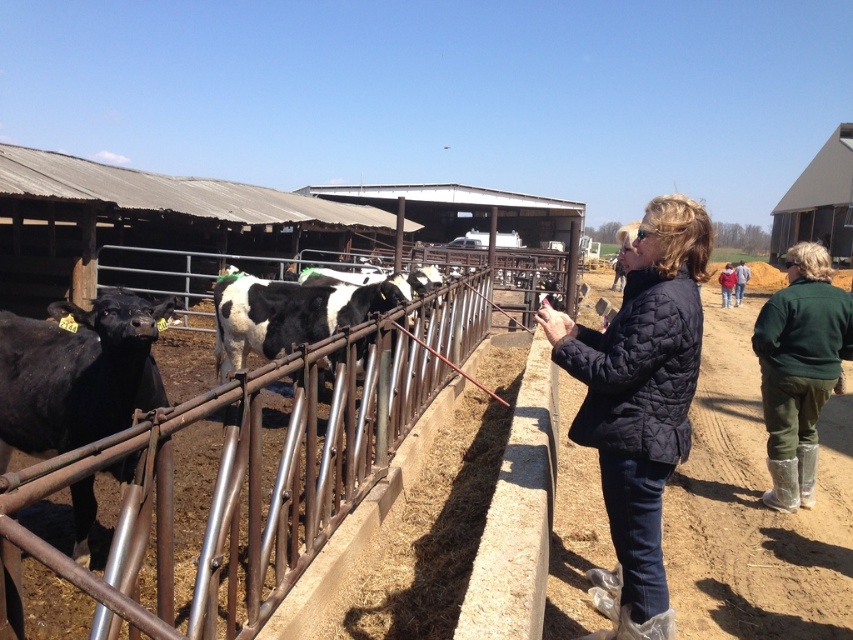
Question: Which of the following is the closest to the observer?

Choices:
 (A) (32, 410)
 (B) (798, 502)

Answer: (A)

Question: Which of these objects is positioned closest to the green fabric jacket at right?

Choices:
 (A) green fabric jacket at center
 (B) green fleece jacket at center
 (C) brushed metal fence at center
 (D) black smooth cow at left

Answer: (C)

Question: Which of the following is the closest to the observer?

Choices:
 (A) quilted navy jacket at center
 (B) green fabric jacket at right
 (C) black and white spotted cow at center

Answer: (A)

Question: Can you confirm if brushed metal fence at center is smaller than black and white spotted cow at center?

Choices:
 (A) yes
 (B) no

Answer: (A)

Question: Can you confirm if black and white spotted cow at center is positioned above green fabric jacket at center?

Choices:
 (A) no
 (B) yes

Answer: (A)

Question: Does green fabric jacket at right lie in front of black and white spotted cow at center?

Choices:
 (A) yes
 (B) no

Answer: (A)